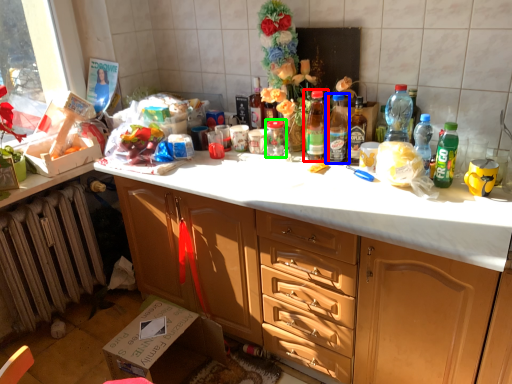
Question: Considering the real-world distances, which object is closest to bottle (highlighted by a red box)? bottle (highlighted by a blue box) or glass jar (highlighted by a green box).

Choices:
 (A) bottle
 (B) glass jar

Answer: (A)